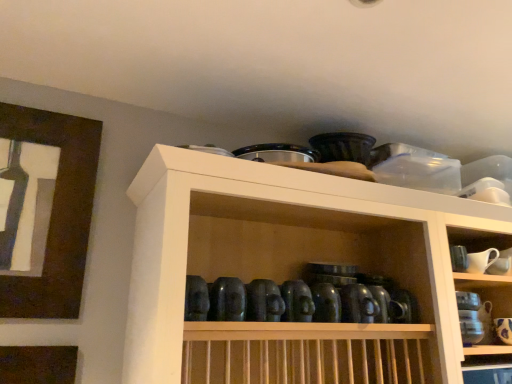
Question: From a real-world perspective, is white ceramic pitcher at upper right, the second tableware from the bottom, above or below brown wooden picture frame at upper left?

Choices:
 (A) below
 (B) above

Answer: (A)

Question: Considering the positions of white ceramic pitcher at upper right, the second tableware from the bottom, and brown wooden picture frame at upper left in the image, is white ceramic pitcher at upper right, the second tableware from the bottom, bigger or smaller than brown wooden picture frame at upper left?

Choices:
 (A) big
 (B) small

Answer: (B)

Question: Estimate the real-world distances between objects in this image. Which object is closer to the brown wooden picture frame at upper left?

Choices:
 (A) white ceramic pitcher at upper right, which is counted as the 1th tableware, starting from the left
 (B) white glossy mug at upper right, the 1th tableware in the bottom-to-top sequence
 (C) matte black bowls at upper center

Answer: (C)

Question: Which object is the closest to the white ceramic pitcher at upper right, which is counted as the 2th tableware, starting from the right?

Choices:
 (A) white glossy mug at upper right, marked as the second tableware in a top-to-bottom arrangement
 (B) brown wooden picture frame at upper left
 (C) matte black bowls at upper center

Answer: (A)